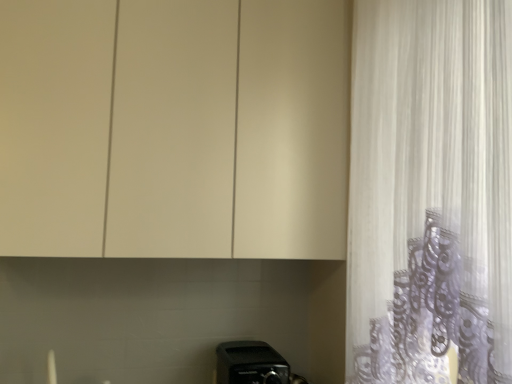
What do you see at coordinates (430, 192) in the screenshot?
I see `white sheer curtain at right` at bounding box center [430, 192].

Identify the location of white sheer curtain at right. (430, 192).

What's the angular difference between black plastic toaster at lower center and white sheer curtain at right's facing directions?

There is a 91-degree angle between the facing directions of black plastic toaster at lower center and white sheer curtain at right.

Image resolution: width=512 pixels, height=384 pixels. In order to click on curtain above the black plastic toaster at lower center (from the image's perspective) in this screenshot , I will do `click(430, 192)`.

Consider the image. In terms of size, does black plastic toaster at lower center appear bigger or smaller than white sheer curtain at right?

Clearly, black plastic toaster at lower center is smaller in size than white sheer curtain at right.

Can you confirm if black plastic toaster at lower center is positioned to the right of white sheer curtain at right?

In fact, black plastic toaster at lower center is to the left of white sheer curtain at right.

Is black plastic toaster at lower center oriented away from matte white cabinet at upper center?

No, black plastic toaster at lower center is not facing the opposite direction of matte white cabinet at upper center.

Which object is closer to the camera, black plastic toaster at lower center or matte white cabinet at upper center?

matte white cabinet at upper center.

Would you say black plastic toaster at lower center is outside matte white cabinet at upper center?

Absolutely, black plastic toaster at lower center is external to matte white cabinet at upper center.

Which of these two, black plastic toaster at lower center or matte white cabinet at upper center, is wider?

black plastic toaster at lower center.

Is matte white cabinet at upper center in front of or behind black plastic toaster at lower center in the image?

matte white cabinet at upper center is in front of black plastic toaster at lower center.

Could you tell me if matte white cabinet at upper center is turned towards black plastic toaster at lower center?

No, matte white cabinet at upper center is not turned towards black plastic toaster at lower center.

From the image's perspective, which one is positioned higher, matte white cabinet at upper center or black plastic toaster at lower center?

matte white cabinet at upper center, from the image's perspective.

You are a GUI agent. You are given a task and a screenshot of the screen. Output one action in this format:
    pyautogui.click(x=<x>, y=<y>)
    Task: Click on the cabinetry on the left side of black plastic toaster at lower center
    This screenshot has height=384, width=512.
    Given the screenshot: What is the action you would take?
    pyautogui.click(x=174, y=128)

Is matte white cabinet at upper center turned away from white sheer curtain at right?

No.

Can you confirm if matte white cabinet at upper center is positioned to the left of white sheer curtain at right?

Indeed, matte white cabinet at upper center is positioned on the left side of white sheer curtain at right.

From the image's perspective, does matte white cabinet at upper center appear lower than white sheer curtain at right?

No.

Between matte white cabinet at upper center and white sheer curtain at right, which one has larger size?

With larger size is matte white cabinet at upper center.

Who is more distant, white sheer curtain at right or matte white cabinet at upper center?

matte white cabinet at upper center is further from the camera.

Is white sheer curtain at right placed right next to matte white cabinet at upper center?

No, white sheer curtain at right is not making contact with matte white cabinet at upper center.

Is white sheer curtain at right oriented towards matte white cabinet at upper center?

No, white sheer curtain at right is not aimed at matte white cabinet at upper center.

Considering the sizes of white sheer curtain at right and matte white cabinet at upper center in the image, is white sheer curtain at right wider or thinner than matte white cabinet at upper center?

In the image, white sheer curtain at right appears to be more narrow than matte white cabinet at upper center.

From a real-world perspective, who is located higher, white sheer curtain at right or black plastic toaster at lower center?

In real-world perspective, white sheer curtain at right is above.

In the image, is white sheer curtain at right on the left side or the right side of black plastic toaster at lower center?

Based on their positions, white sheer curtain at right is located to the right of black plastic toaster at lower center.

Is white sheer curtain at right with black plastic toaster at lower center?

No, white sheer curtain at right is not with black plastic toaster at lower center.

Is white sheer curtain at right positioned behind black plastic toaster at lower center?

No, the depth of white sheer curtain at right is less than that of black plastic toaster at lower center.

You are a GUI agent. You are given a task and a screenshot of the screen. Output one action in this format:
    pyautogui.click(x=<x>, y=<y>)
    Task: Click on the curtain above the black plastic toaster at lower center (from a real-world perspective)
    
    Given the screenshot: What is the action you would take?
    pyautogui.click(x=430, y=192)

Image resolution: width=512 pixels, height=384 pixels. In order to click on appliance below the matte white cabinet at upper center (from a real-world perspective) in this screenshot , I will do `click(250, 364)`.

Looking at the image, which one is located closer to black plastic toaster at lower center, matte white cabinet at upper center or white sheer curtain at right?

matte white cabinet at upper center lies closer to black plastic toaster at lower center than the other object.

When comparing their distances from matte white cabinet at upper center, does white sheer curtain at right or black plastic toaster at lower center seem closer?

white sheer curtain at right is positioned closer to the anchor matte white cabinet at upper center.

Estimate the real-world distances between objects in this image. Which object is further from matte white cabinet at upper center, black plastic toaster at lower center or white sheer curtain at right?

The object further to matte white cabinet at upper center is black plastic toaster at lower center.

Based on their spatial positions, is matte white cabinet at upper center or black plastic toaster at lower center further from white sheer curtain at right?

black plastic toaster at lower center lies further to white sheer curtain at right than the other object.

Based on their spatial positions, is black plastic toaster at lower center or matte white cabinet at upper center closer to white sheer curtain at right?

matte white cabinet at upper center is positioned closer to the anchor white sheer curtain at right.

Which object lies further to the anchor point black plastic toaster at lower center, white sheer curtain at right or matte white cabinet at upper center?

white sheer curtain at right.

Identify the location of curtain between matte white cabinet at upper center and black plastic toaster at lower center in the vertical direction. The width and height of the screenshot is (512, 384). (430, 192).